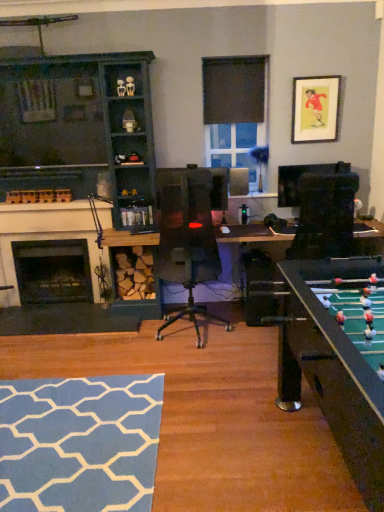
Question: Can you confirm if dark wood cabinet at left is shorter than black matte fireplace at left, the 1th fireplace from the back?

Choices:
 (A) no
 (B) yes

Answer: (A)

Question: Does dark wood cabinet at left have a lesser width compared to black matte fireplace at left, the 2th fireplace positioned from the front?

Choices:
 (A) yes
 (B) no

Answer: (B)

Question: Is dark wood cabinet at left positioned far away from black matte fireplace at left, the 1th fireplace from the back?

Choices:
 (A) no
 (B) yes

Answer: (A)

Question: Is the position of dark wood cabinet at left more distant than that of black matte fireplace at left, the 1th fireplace from the back?

Choices:
 (A) no
 (B) yes

Answer: (A)

Question: Is dark wood cabinet at left in contact with black matte fireplace at left, the 2th fireplace positioned from the front?

Choices:
 (A) no
 (B) yes

Answer: (A)

Question: Relative to white painted wood fireplace at left, placed as the second fireplace when sorted from back to front, is matte paper picture frame at upper right in front or behind?

Choices:
 (A) front
 (B) behind

Answer: (A)

Question: From the image's perspective, is matte paper picture frame at upper right above or below white painted wood fireplace at left, the 1th fireplace in the front-to-back sequence?

Choices:
 (A) below
 (B) above

Answer: (B)

Question: Is point 327,88 positioned closer to the camera than point 77,222?

Choices:
 (A) farther
 (B) closer

Answer: (B)

Question: Which is correct: matte paper picture frame at upper right is inside white painted wood fireplace at left, placed as the second fireplace when sorted from back to front, or outside of it?

Choices:
 (A) outside
 (B) inside

Answer: (A)

Question: Does point (235, 150) appear closer or farther from the camera than point (21, 128)?

Choices:
 (A) closer
 (B) farther

Answer: (B)

Question: In terms of height, does clear glass window at center look taller or shorter compared to dark wood cabinet at left?

Choices:
 (A) tall
 (B) short

Answer: (B)

Question: From the image's perspective, is clear glass window at center positioned above or below dark wood cabinet at left?

Choices:
 (A) below
 (B) above

Answer: (B)

Question: Looking at their shapes, would you say clear glass window at center is wider or thinner than dark wood cabinet at left?

Choices:
 (A) thin
 (B) wide

Answer: (A)

Question: From a real-world perspective, is black matte fireplace at left, the 1th fireplace from the back, positioned above or below dark wood cabinet at left?

Choices:
 (A) above
 (B) below

Answer: (B)

Question: Is black matte fireplace at left, the 1th fireplace from the back, spatially inside dark wood cabinet at left, or outside of it?

Choices:
 (A) outside
 (B) inside

Answer: (B)